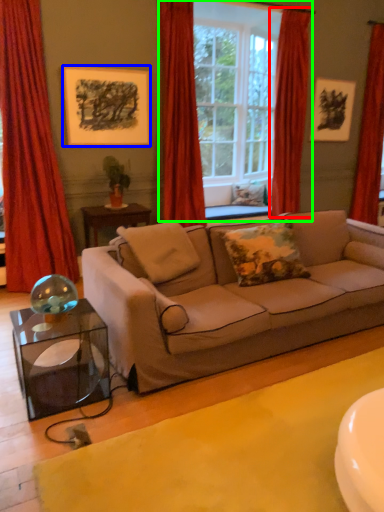
Question: Considering the real-world distances, which object is farthest from curtain (highlighted by a red box)? picture frame (highlighted by a blue box) or window (highlighted by a green box)?

Choices:
 (A) picture frame
 (B) window

Answer: (A)